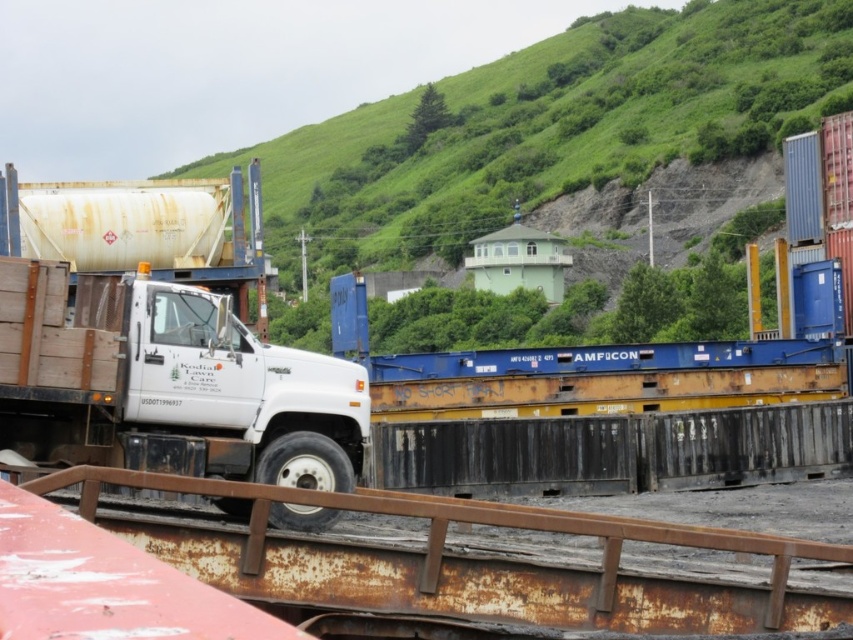
You are standing at the point labeled as point [548,128] in the image. What do you see around you?

You are standing on the green grassy hillside at upper center.